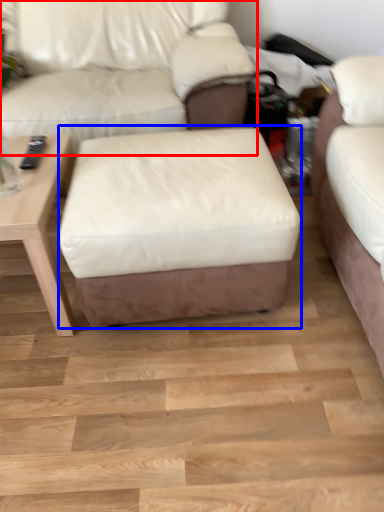
Question: Which point is further to the camera, studio couch (highlighted by a red box) or stool (highlighted by a blue box)?

Choices:
 (A) studio couch
 (B) stool

Answer: (A)